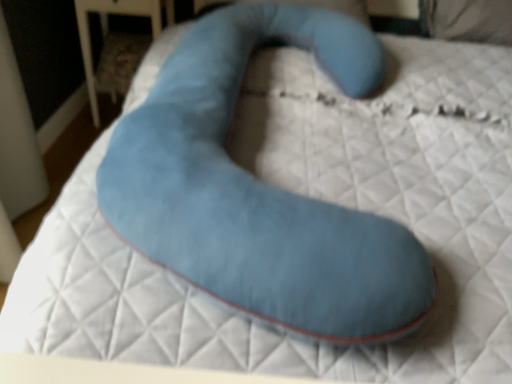
Where is `velvet-like blue bean bag chair at upper left`? velvet-like blue bean bag chair at upper left is located at coordinates tap(120, 61).

What do you see at coordinates (120, 61) in the screenshot? I see `velvet-like blue bean bag chair at upper left` at bounding box center [120, 61].

Where is `velvet-like blue bean bag chair at upper left`? velvet-like blue bean bag chair at upper left is located at coordinates (120, 61).